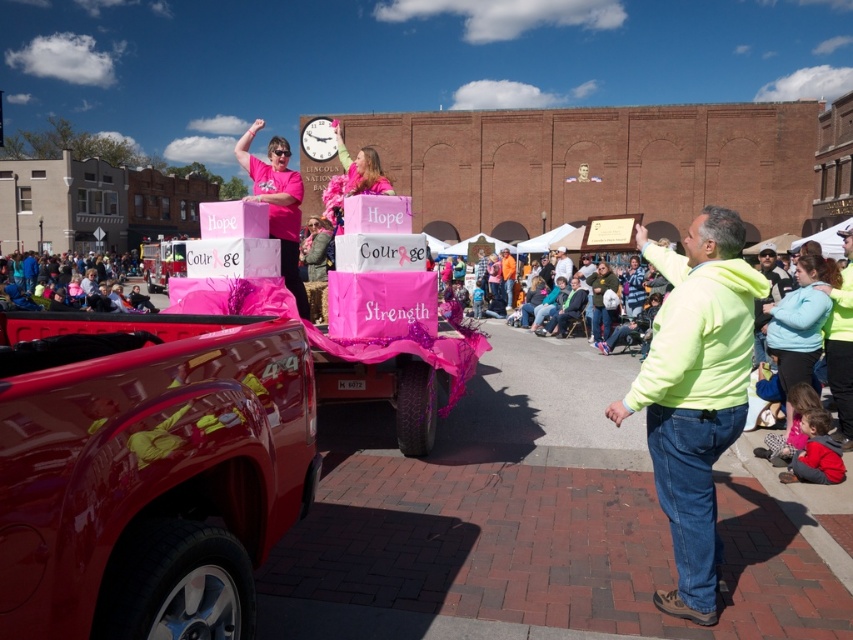
You are attending the community parade and notice the light blue fleece jacket at lower right. Based on its position relative to the float and the truck, can you determine if the jacket is closer to the float or the truck?

The light blue fleece jacket at lower right is located at point (799, 321). Since the float is being pulled by the truck, the jacket is likely closer to the float than the truck.

You are a photographer at the parade. You want to take a photo that includes both the light blue fleece jacket at lower right and the pink fabric crowd at lower left. Which of the two objects should be placed closer to the foreground to ensure both are in focus?

The light blue fleece jacket at lower right has a lesser height compared to the pink fabric crowd at lower left. To ensure both are in focus, the photographer should place the light blue fleece jacket at lower right closer to the foreground since it is shorter and needs to be emphasized.

You are a photographer standing in the middle of the street during the parade. You want to take a photo that includes both the shiny red truck at lower left and the light blue fleece jacket at lower right. Which object should you focus on first if you want to ensure both are in the frame?

Answer: The shiny red truck at lower left is not as tall as the light blue fleece jacket at lower right, so you should focus on the light blue fleece jacket at lower right first to ensure both are in the frame.